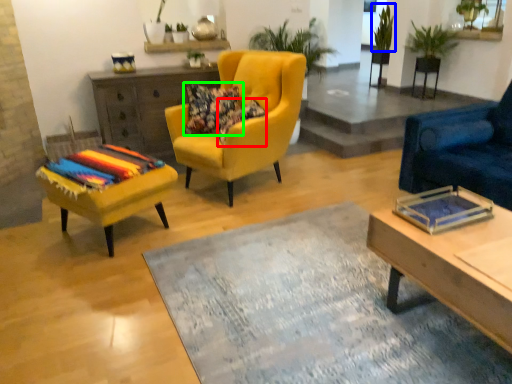
Question: Based on their relative distances, which object is farther from pillow (highlighted by a red box)? Choose from plant (highlighted by a blue box) and pillow (highlighted by a green box).

Choices:
 (A) plant
 (B) pillow

Answer: (A)